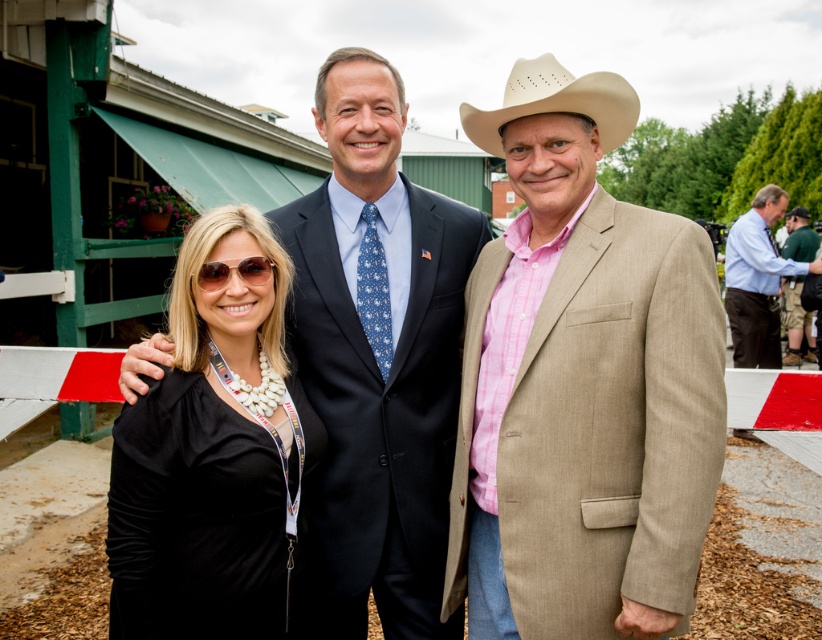
Question: Can you confirm if black velvet dress at left is positioned below blue shirt at center?

Choices:
 (A) yes
 (B) no

Answer: (A)

Question: Which of the following is the closest to the observer?

Choices:
 (A) (271, 376)
 (B) (608, 116)
 (C) (645, 387)

Answer: (C)

Question: Is black velvet dress at left to the right of green cotton shirt at right from the viewer's perspective?

Choices:
 (A) yes
 (B) no

Answer: (B)

Question: Estimate the real-world distances between objects in this image. Which object is closer to the blue shirt at center?

Choices:
 (A) matte black suit at center
 (B) tan textured suit at center
 (C) green cotton shirt at right

Answer: (C)

Question: Can you confirm if tan textured suit at center is smaller than beige felt cowboy hat at right?

Choices:
 (A) yes
 (B) no

Answer: (B)

Question: Which object is the farthest from the beige felt cowboy hat at right?

Choices:
 (A) matte black suit at center
 (B) green cotton shirt at right
 (C) tan textured suit at center
 (D) black velvet dress at left

Answer: (B)